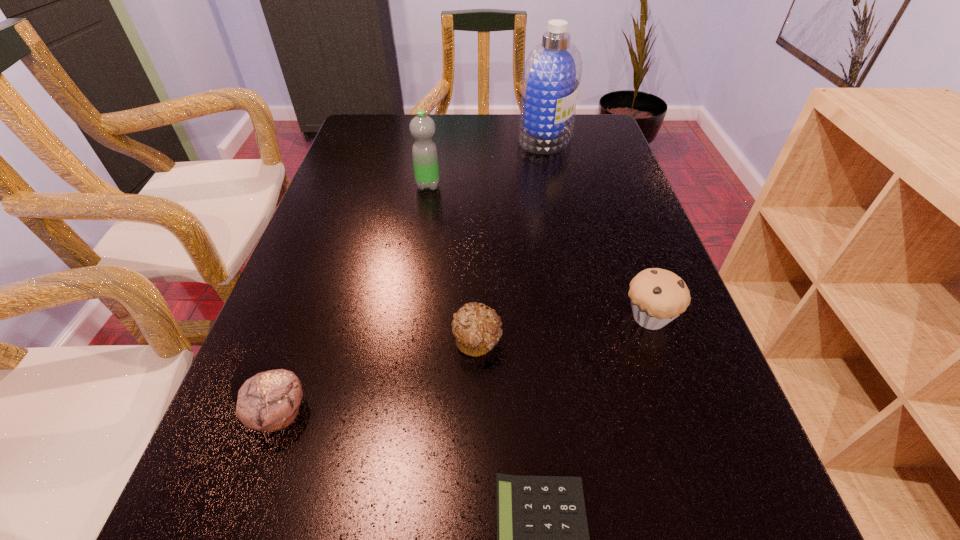
Image resolution: width=960 pixels, height=540 pixels. What are the coordinates of `object that ranks as the third closest to the shortest object` in the screenshot? It's located at (269, 401).

Identify which object is the third closest to the second muffin from left to right. Please provide its 2D coordinates. Your answer should be formatted as a tuple, i.e. [(x, y)], where the tuple contains the x and y coordinates of a point satisfying the conditions above.

[(658, 296)]

The height and width of the screenshot is (540, 960). Identify the location of muffin object that ranks as the closest to the nearest muffin. (477, 330).

Identify the location of the second closest muffin relative to the nearest muffin. (658, 296).

Locate an element on the screen. vacant point that satisfies the following two spatial constraints: 1. on the front side of the third tallest object; 2. on the left side of the second object from left to right is located at coordinates pos(408,318).